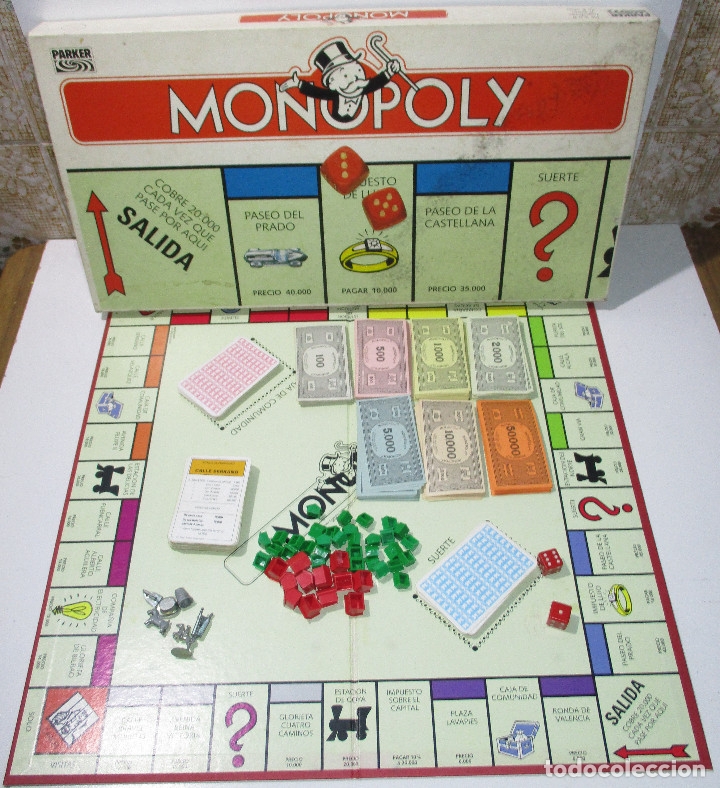
Locate an element on the screen. This screenshot has width=720, height=788. monopoly game pieces is located at coordinates (150, 599), (170, 603), (184, 597), (158, 619), (184, 649), (198, 623).